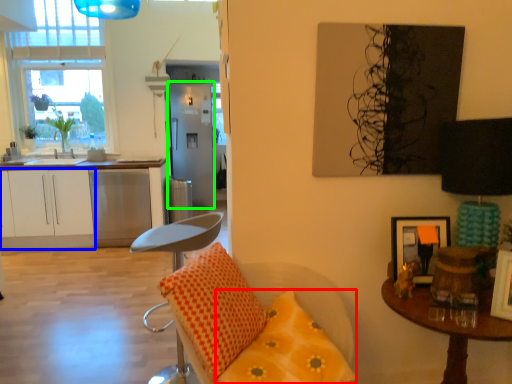
Question: Based on their relative distances, which object is farther from pillow (highlighted by a red box)? Choose from cabinetry (highlighted by a blue box) and fridge (highlighted by a green box).

Choices:
 (A) cabinetry
 (B) fridge

Answer: (B)